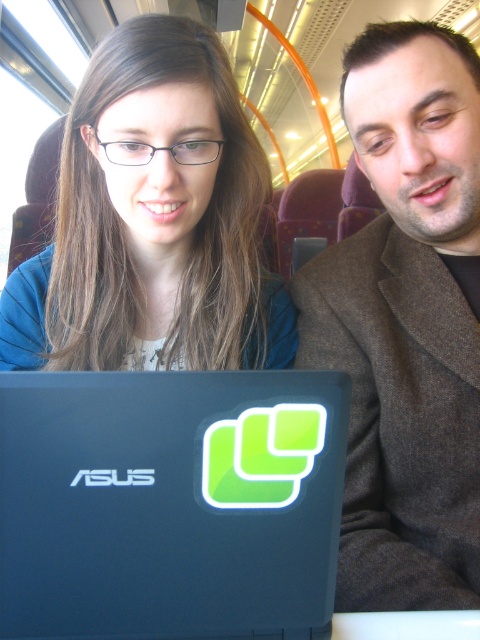
The width and height of the screenshot is (480, 640). Find the location of `brown woolen jacket at right`. brown woolen jacket at right is located at coordinates (407, 323).

From the picture: Measure the distance between point (416, 88) and camera.

Point (416, 88) and camera are 28.23 inches apart from each other.

You are a GUI agent. You are given a task and a screenshot of the screen. Output one action in this format:
    pyautogui.click(x=<x>, y=<y>)
    Task: Click on the brown woolen jacket at right
    This screenshot has height=640, width=480.
    Given the screenshot: What is the action you would take?
    pyautogui.click(x=407, y=323)

Does blue matte laptop at center lie in front of matte blue shirt at upper left?

Yes, it is.

Does blue matte laptop at center have a lesser height compared to matte blue shirt at upper left?

Correct, blue matte laptop at center is not as tall as matte blue shirt at upper left.

This screenshot has width=480, height=640. I want to click on blue matte laptop at center, so click(169, 502).

Can you confirm if blue matte laptop at center is taller than brown woolen jacket at right?

No.

Identify the location of blue matte laptop at center. (169, 502).

At what (x,y) coordinates should I click in order to perform the action: click on blue matte laptop at center. Please return your answer as a coordinate pair (x, y). The image size is (480, 640). Looking at the image, I should click on tap(169, 502).